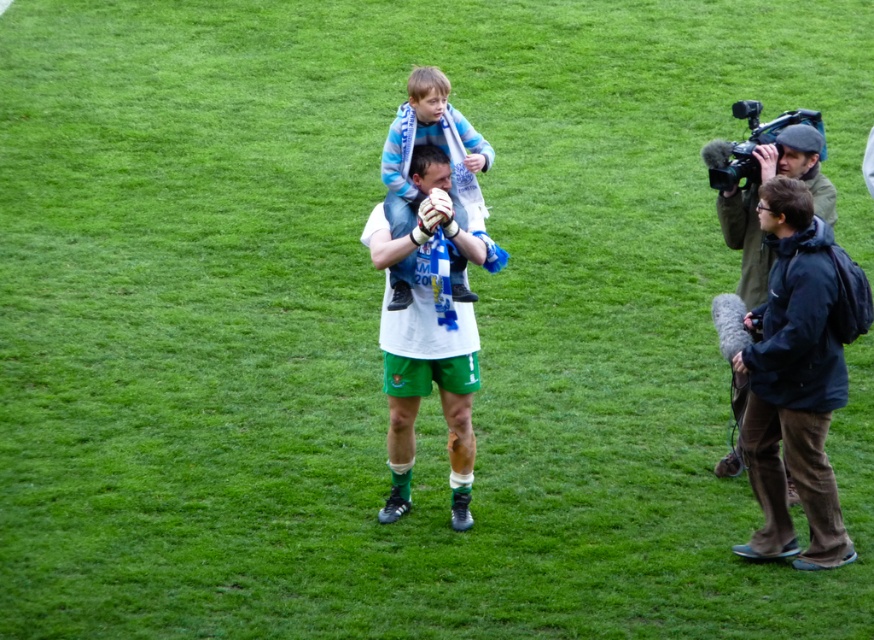
In the scene shown: Which is more to the left, white fabric shirt at center or dark green jacket at right?

white fabric shirt at center

Can you confirm if white fabric shirt at center is thinner than dark green jacket at right?

In fact, white fabric shirt at center might be wider than dark green jacket at right.

Is point (454, 221) positioned in front of point (760, 147)?

That is True.

The width and height of the screenshot is (874, 640). In order to click on white fabric shirt at center in this screenshot , I will do `click(429, 333)`.

Between white fabric shirt at center and blue striped scarf at center, which one has more height?

With more height is white fabric shirt at center.

Which of these two, white fabric shirt at center or blue striped scarf at center, stands shorter?

Standing shorter between the two is blue striped scarf at center.

Between point (449, 448) and point (458, 168), which one is positioned in front?

Positioned in front is point (449, 448).

The image size is (874, 640). Find the location of `white fabric shirt at center`. white fabric shirt at center is located at coordinates (429, 333).

Can you confirm if blue striped scarf at center is positioned to the right of dark green jacket at right?

No, blue striped scarf at center is not to the right of dark green jacket at right.

Is blue striped scarf at center smaller than dark green jacket at right?

No.

The height and width of the screenshot is (640, 874). Find the location of `blue striped scarf at center`. blue striped scarf at center is located at coordinates (429, 144).